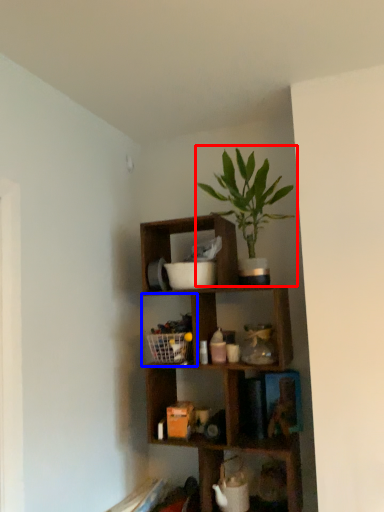
Question: Which object is further to the camera taking this photo, houseplant (highlighted by a red box) or cabinet (highlighted by a blue box)?

Choices:
 (A) houseplant
 (B) cabinet

Answer: (B)